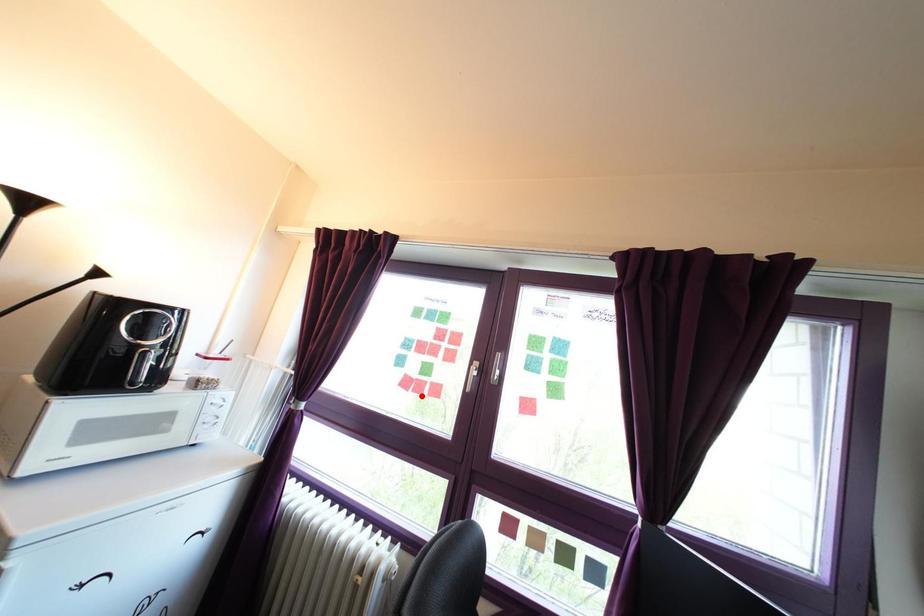
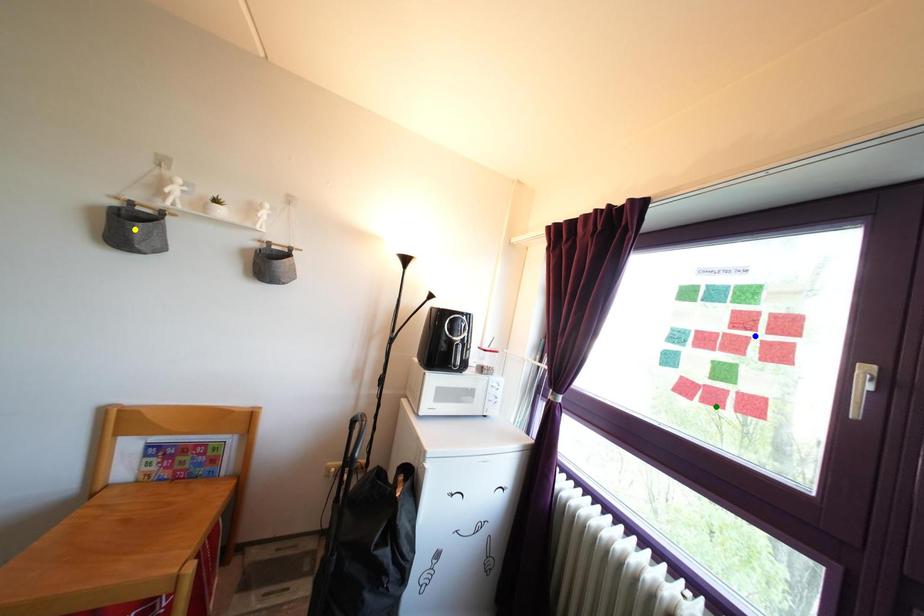
Question: I am providing you with two images of the same scene from different viewpoints. A red point is marked on the first image. You are given multiple points on the second image. Which point in image 2 represents the same 3d spot as the red point in image 1?

Choices:
 (A) blue point
 (B) yellow point
 (C) green point

Answer: (C)